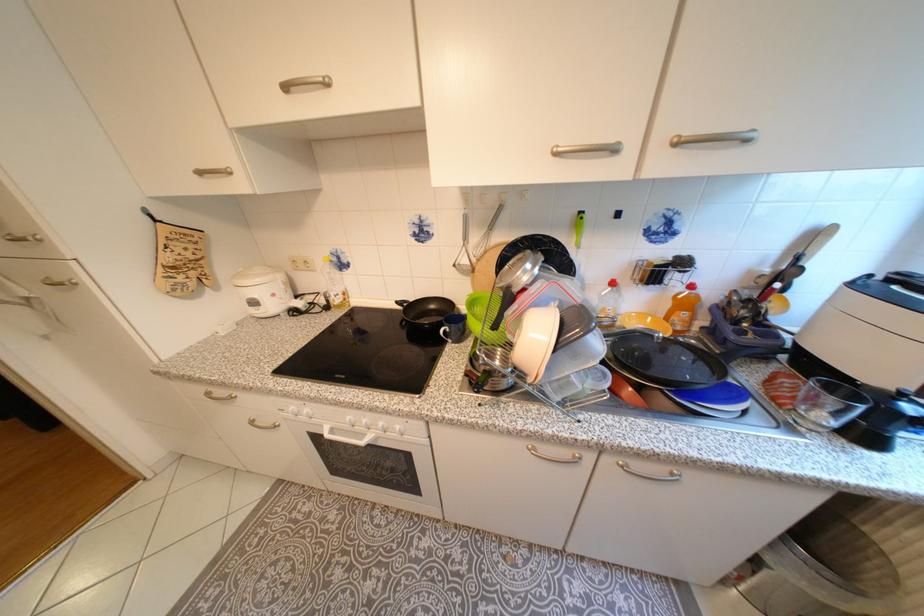
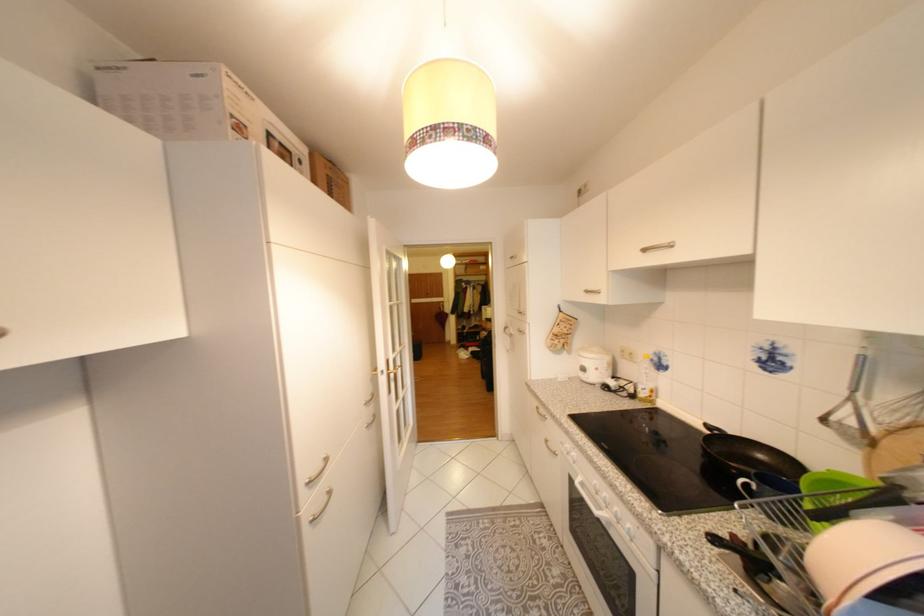
Find the pixel in the second image that matches [263,304] in the first image.

(592, 370)